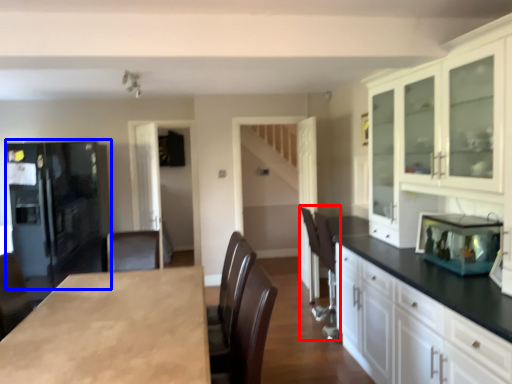
Question: Which point is closer to the camera, armchair (highlighted by a red box) or refrigerator (highlighted by a blue box)?

Choices:
 (A) armchair
 (B) refrigerator

Answer: (A)